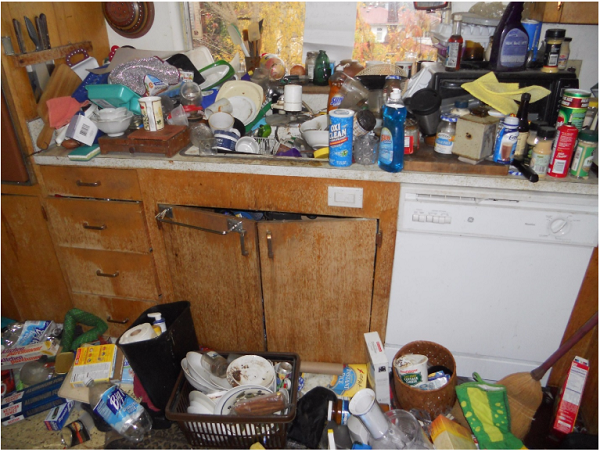
The width and height of the screenshot is (600, 452). I want to click on plastic basket, so click(181, 417).